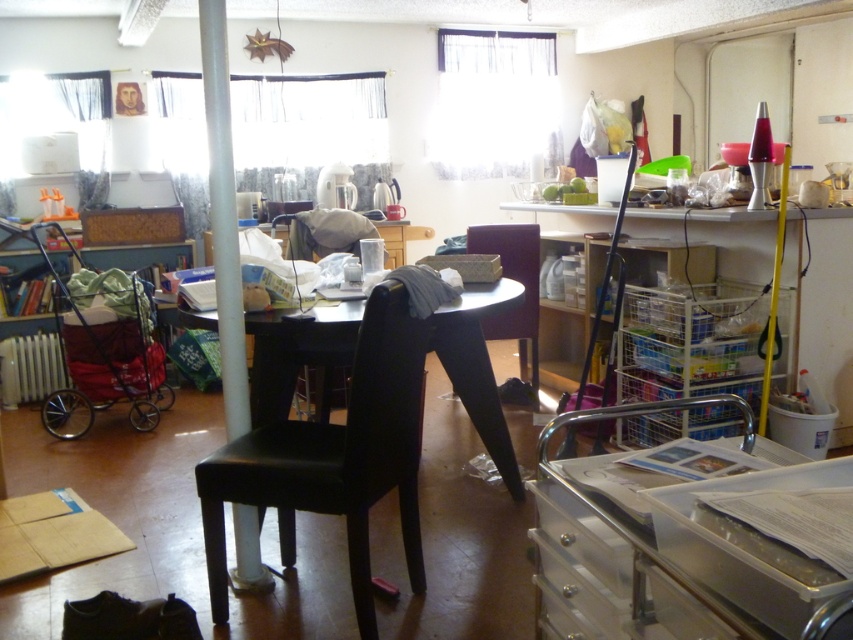
Question: Which is nearer to the black leather chair at center?

Choices:
 (A) black leather table at center
 (B) metallic pole at center
 (C) matte black chair at center

Answer: (A)

Question: Which of the following is the farthest from the observer?

Choices:
 (A) black leather table at center
 (B) matte black chair at center

Answer: (B)

Question: Is black leather table at center closer to camera compared to matte black chair at center?

Choices:
 (A) yes
 (B) no

Answer: (A)

Question: Among these objects, which one is nearest to the camera?

Choices:
 (A) matte black chair at center
 (B) metallic pole at center
 (C) black leather table at center

Answer: (C)

Question: In this image, where is black leather chair at center located relative to black leather table at center?

Choices:
 (A) above
 (B) below

Answer: (B)

Question: Can you confirm if black leather table at center is positioned above metallic pole at center?

Choices:
 (A) yes
 (B) no

Answer: (B)